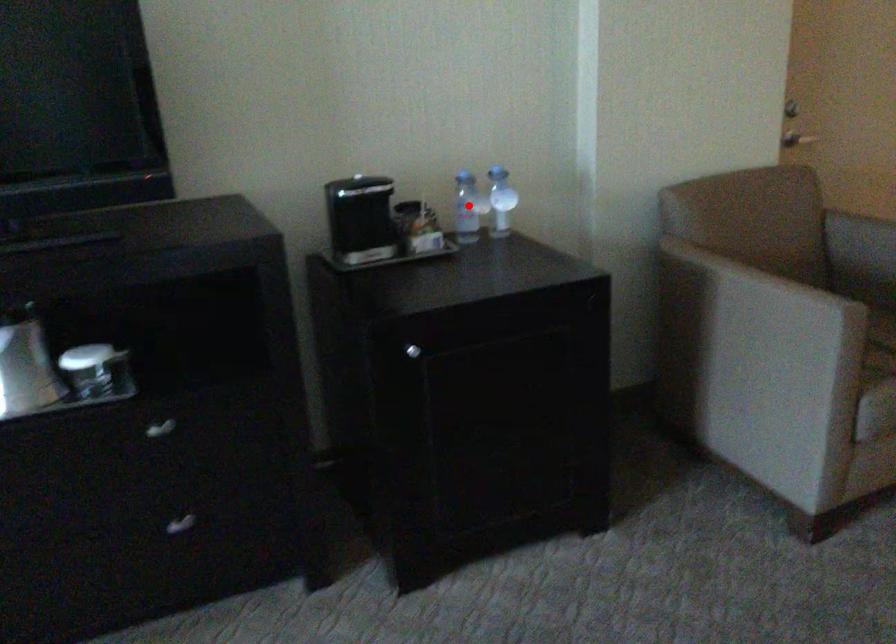
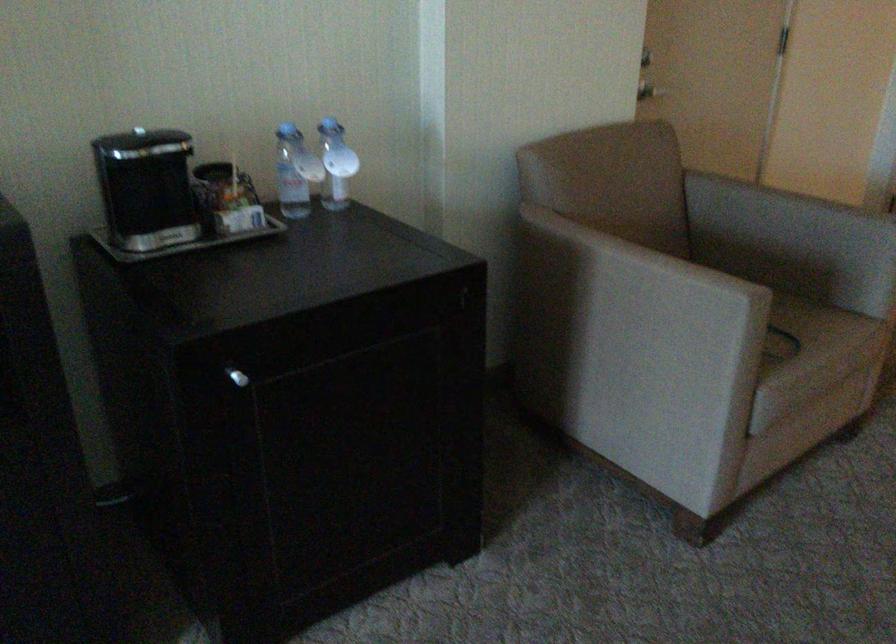
Find the pixel in the second image that matches the highlighted location in the first image.

(295, 172)